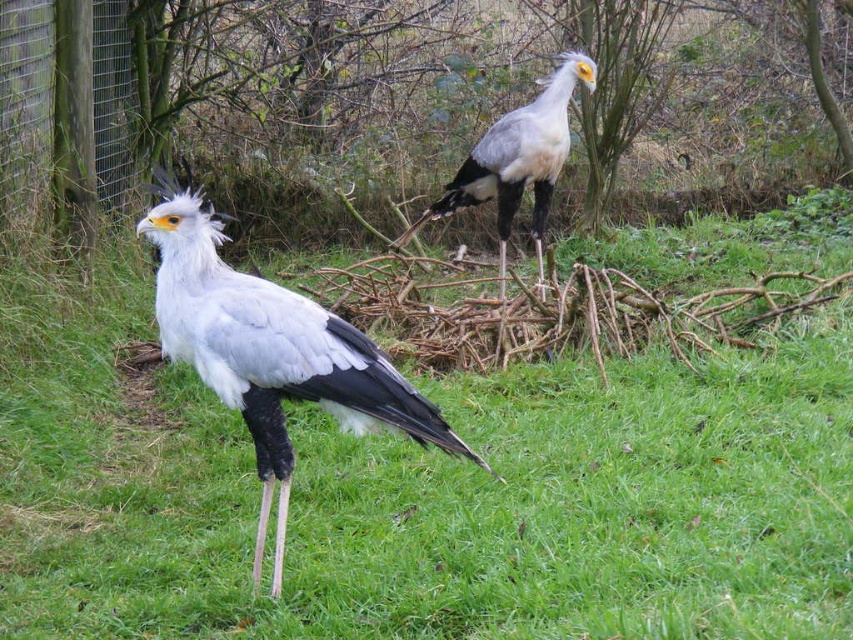
Does point (169, 276) come behind point (521, 154)?

No, (169, 276) is closer to viewer.

Does white matte bird at center have a smaller size compared to white matte bird at upper center?

Indeed, white matte bird at center has a smaller size compared to white matte bird at upper center.

Where is `white matte bird at center`? This screenshot has width=853, height=640. white matte bird at center is located at coordinates pyautogui.click(x=271, y=353).

I want to click on white matte bird at center, so click(271, 353).

What do you see at coordinates (430, 497) in the screenshot?
I see `green grass at center` at bounding box center [430, 497].

Image resolution: width=853 pixels, height=640 pixels. I want to click on green grass at center, so click(x=430, y=497).

Which is more to the left, green grass at center or white matte bird at upper center?

Positioned to the left is green grass at center.

Between point (517, 611) and point (537, 131), which one is positioned behind?

The point (537, 131) is more distant.

Is point (746, 243) closer to viewer compared to point (538, 104)?

No, (746, 243) is further to viewer.

Where is `green grass at center`? The width and height of the screenshot is (853, 640). green grass at center is located at coordinates (430, 497).